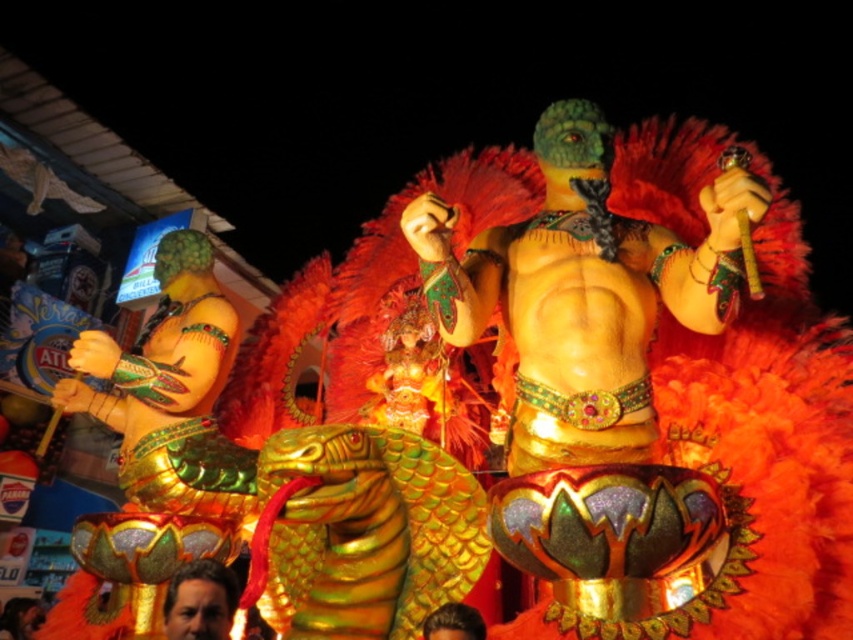
Question: Is shiny gold statue at center thinner than smooth skin face at lower left?

Choices:
 (A) no
 (B) yes

Answer: (A)

Question: Among these objects, which one is farthest from the camera?

Choices:
 (A) smooth skin face at lower left
 (B) shiny gold statue at center
 (C) brown hair at center

Answer: (A)

Question: Can you confirm if shiny gold statue at center is positioned below brown hair at center?

Choices:
 (A) yes
 (B) no

Answer: (B)

Question: Where is smooth skin face at lower left located in relation to brown hair at center in the image?

Choices:
 (A) right
 (B) left

Answer: (B)

Question: Estimate the real-world distances between objects in this image. Which object is farther from the brown hair at center?

Choices:
 (A) smooth skin face at lower left
 (B) shiny gold statue at center

Answer: (B)

Question: Which point is farther to the camera?

Choices:
 (A) (193, 609)
 (B) (636, 316)
 (C) (460, 611)

Answer: (A)